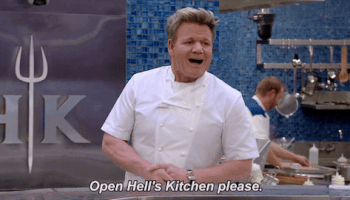
Where is `fridge`? fridge is located at coordinates [x=76, y=67].